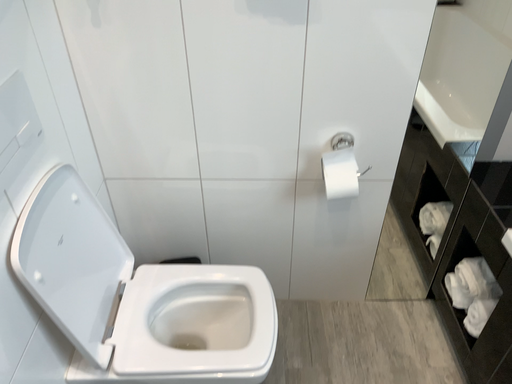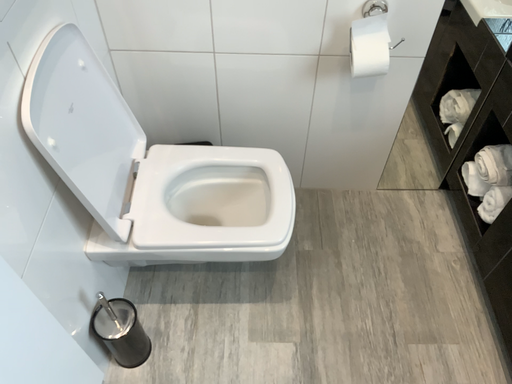
Question: Which way did the camera rotate in the video?

Choices:
 (A) rotated upward
 (B) rotated downward

Answer: (B)